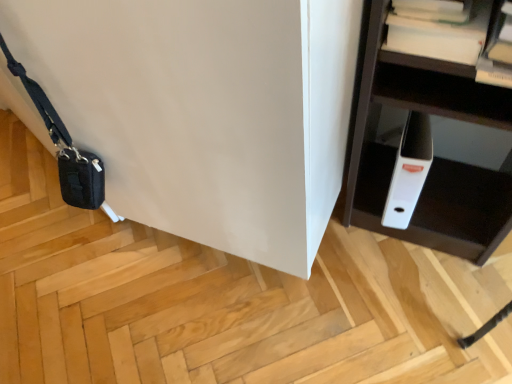
Question: Can you confirm if white paper at upper right is thinner than black fabric messenger bag at lower left?

Choices:
 (A) no
 (B) yes

Answer: (A)

Question: Is white paper at upper right placed right next to black fabric messenger bag at lower left?

Choices:
 (A) yes
 (B) no

Answer: (B)

Question: Considering the relative sizes of white paper at upper right and black fabric messenger bag at lower left in the image provided, is white paper at upper right bigger than black fabric messenger bag at lower left?

Choices:
 (A) yes
 (B) no

Answer: (B)

Question: Can we say white paper at upper right lies outside black fabric messenger bag at lower left?

Choices:
 (A) no
 (B) yes

Answer: (B)

Question: From the image's perspective, is white paper at upper right under black fabric messenger bag at lower left?

Choices:
 (A) yes
 (B) no

Answer: (B)

Question: Does white paper at upper right turn towards black fabric messenger bag at lower left?

Choices:
 (A) yes
 (B) no

Answer: (B)

Question: From a real-world perspective, is black fabric messenger bag at lower left beneath white paper at upper right?

Choices:
 (A) no
 (B) yes

Answer: (B)

Question: Is black fabric messenger bag at lower left at the right side of white paper at upper right?

Choices:
 (A) yes
 (B) no

Answer: (B)

Question: Does black fabric messenger bag at lower left have a lesser width compared to white paper at upper right?

Choices:
 (A) yes
 (B) no

Answer: (A)

Question: Considering the relative positions of black fabric messenger bag at lower left and white paper at upper right in the image provided, is black fabric messenger bag at lower left to the left of white paper at upper right from the viewer's perspective?

Choices:
 (A) yes
 (B) no

Answer: (A)

Question: Is black fabric messenger bag at lower left oriented away from white paper at upper right?

Choices:
 (A) yes
 (B) no

Answer: (B)

Question: Is the position of black fabric messenger bag at lower left less distant than that of white paper at upper right?

Choices:
 (A) yes
 (B) no

Answer: (B)

Question: Considering the positions of white paper at upper right and black fabric messenger bag at lower left in the image, is white paper at upper right taller or shorter than black fabric messenger bag at lower left?

Choices:
 (A) short
 (B) tall

Answer: (A)